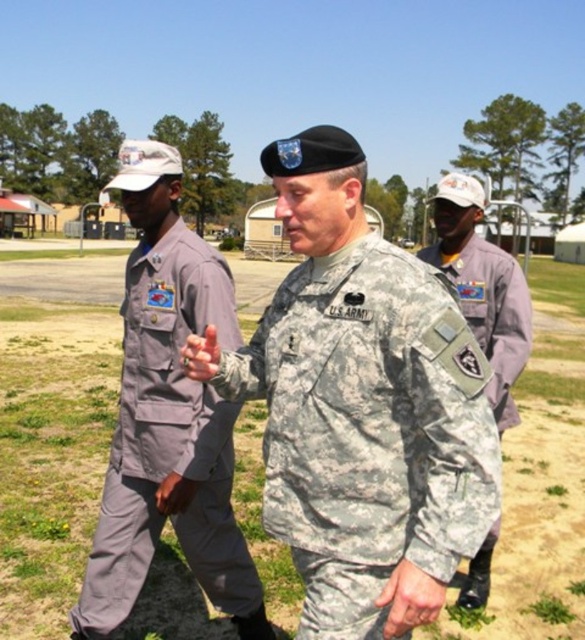
Who is lower down, camouflage fabric us army uniform at center or gray fabric uniform at left?

gray fabric uniform at left is lower down.

Does camouflage fabric us army uniform at center lie behind gray fabric uniform at left?

No, it is not.

At what (x,y) coordinates should I click in order to perform the action: click on camouflage fabric us army uniform at center. Please return your answer as a coordinate pair (x, y). This screenshot has height=640, width=585. Looking at the image, I should click on (371, 416).

Can you confirm if camouflage fabric us army uniform at center is positioned above camouflage fabric uniform at center?

No, camouflage fabric us army uniform at center is not above camouflage fabric uniform at center.

Which is behind, point (287, 451) or point (521, 346)?

The point (521, 346) is more distant.

Where is `camouflage fabric us army uniform at center`? The height and width of the screenshot is (640, 585). camouflage fabric us army uniform at center is located at coordinates (371, 416).

In the scene shown: Does gray fabric uniform at left appear on the right side of camouflage fabric uniform at center?

In fact, gray fabric uniform at left is to the left of camouflage fabric uniform at center.

Is point (164, 365) behind point (450, 211)?

No, it is not.

Describe the element at coordinates (170, 444) in the screenshot. This screenshot has width=585, height=640. I see `gray fabric uniform at left` at that location.

Find the location of a particular element. The height and width of the screenshot is (640, 585). gray fabric uniform at left is located at coordinates (170, 444).